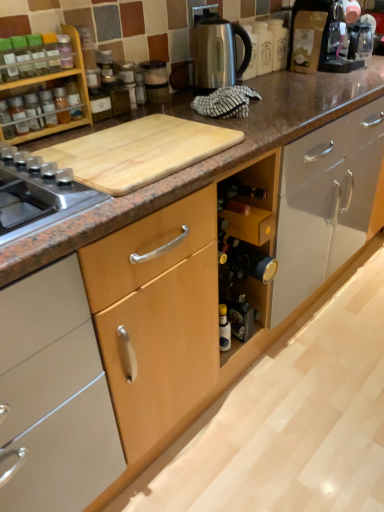
Question: Is matte glass bottle at left, positioned as the 1th bottle in left-to-right order, aimed at translucent glass spice at upper left, the 2th bottle when ordered from right to left?

Choices:
 (A) yes
 (B) no

Answer: (B)

Question: From the image's perspective, is matte glass bottle at left, the 3th bottle viewed from the right, above translucent glass spice at upper left, the 2th bottle when ordered from right to left?

Choices:
 (A) no
 (B) yes

Answer: (A)

Question: From a real-world perspective, is matte glass bottle at left, positioned as the 1th bottle in left-to-right order, beneath translucent glass spice at upper left, the second bottle in the left-to-right sequence?

Choices:
 (A) no
 (B) yes

Answer: (A)

Question: Is the position of matte glass bottle at left, the 3th bottle viewed from the right, more distant than that of translucent glass spice at upper left, the second bottle in the left-to-right sequence?

Choices:
 (A) yes
 (B) no

Answer: (B)

Question: From the image's perspective, would you say matte glass bottle at left, positioned as the 1th bottle in left-to-right order, is shown under translucent glass spice at upper left, the second bottle in the left-to-right sequence?

Choices:
 (A) no
 (B) yes

Answer: (B)

Question: Is translucent glass spice at upper left, the second bottle in the left-to-right sequence, a part of matte glass bottle at left, the 3th bottle viewed from the right?

Choices:
 (A) no
 (B) yes

Answer: (A)

Question: Is metallic silver blender at upper center, positioned as the first appliance in left-to-right order, to the left of natural wood cutting board at upper left from the viewer's perspective?

Choices:
 (A) yes
 (B) no

Answer: (B)

Question: Considering the relative sizes of metallic silver blender at upper center, marked as the 2th appliance in a right-to-left arrangement, and natural wood cutting board at upper left in the image provided, is metallic silver blender at upper center, marked as the 2th appliance in a right-to-left arrangement, shorter than natural wood cutting board at upper left?

Choices:
 (A) no
 (B) yes

Answer: (A)

Question: Is the depth of metallic silver blender at upper center, marked as the 2th appliance in a right-to-left arrangement, greater than that of natural wood cutting board at upper left?

Choices:
 (A) no
 (B) yes

Answer: (B)

Question: Could you tell me if metallic silver blender at upper center, marked as the 2th appliance in a right-to-left arrangement, is facing natural wood cutting board at upper left?

Choices:
 (A) no
 (B) yes

Answer: (A)

Question: Is metallic silver blender at upper center, marked as the 2th appliance in a right-to-left arrangement, looking in the opposite direction of natural wood cutting board at upper left?

Choices:
 (A) yes
 (B) no

Answer: (B)

Question: Can you confirm if metallic silver blender at upper center, positioned as the first appliance in left-to-right order, is wider than natural wood cutting board at upper left?

Choices:
 (A) no
 (B) yes

Answer: (A)

Question: Is satin silver kettle at upper center, which appears as the second appliance when viewed from the left, positioned beyond the bounds of matte glass bottle at left, the 3th bottle viewed from the right?

Choices:
 (A) yes
 (B) no

Answer: (A)